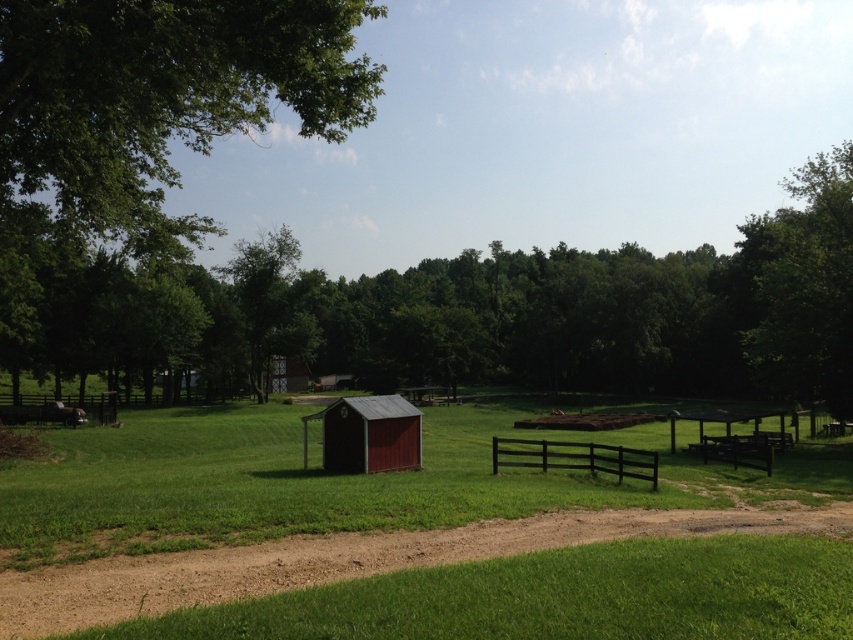
Who is higher up, green leafy tree at upper left or dirt track at lower center?

green leafy tree at upper left

Is point (193, 0) farther from viewer compared to point (468, 554)?

Yes, point (193, 0) is behind point (468, 554).

Looking at this image, who is more forward, (223, 100) or (630, 518)?

Positioned in front is point (630, 518).

This screenshot has height=640, width=853. Identify the location of green leafy tree at upper left. (163, 92).

Between green leafy tree at center and dirt track at lower center, which one appears on the left side from the viewer's perspective?

green leafy tree at center

Locate an element on the screen. Image resolution: width=853 pixels, height=640 pixels. green leafy tree at center is located at coordinates (479, 312).

Does green leafy tree at upper right appear over matte red shed at center?

Indeed, green leafy tree at upper right is positioned over matte red shed at center.

Based on the photo, is green leafy tree at upper right positioned behind matte red shed at center?

That is True.

Which is behind, point (822, 308) or point (409, 454)?

The point (822, 308) is behind.

Where is `green leafy tree at upper right`? green leafy tree at upper right is located at coordinates pos(801,285).